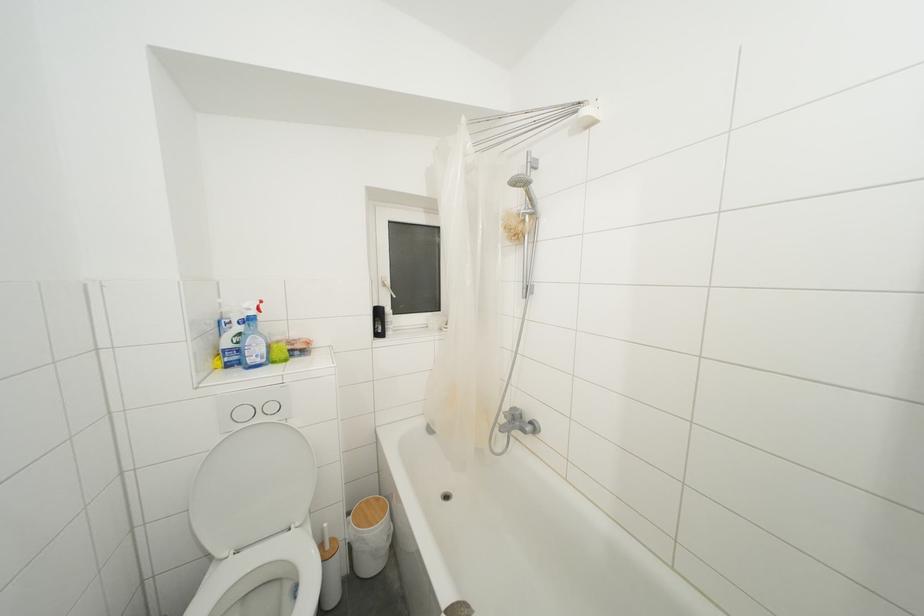
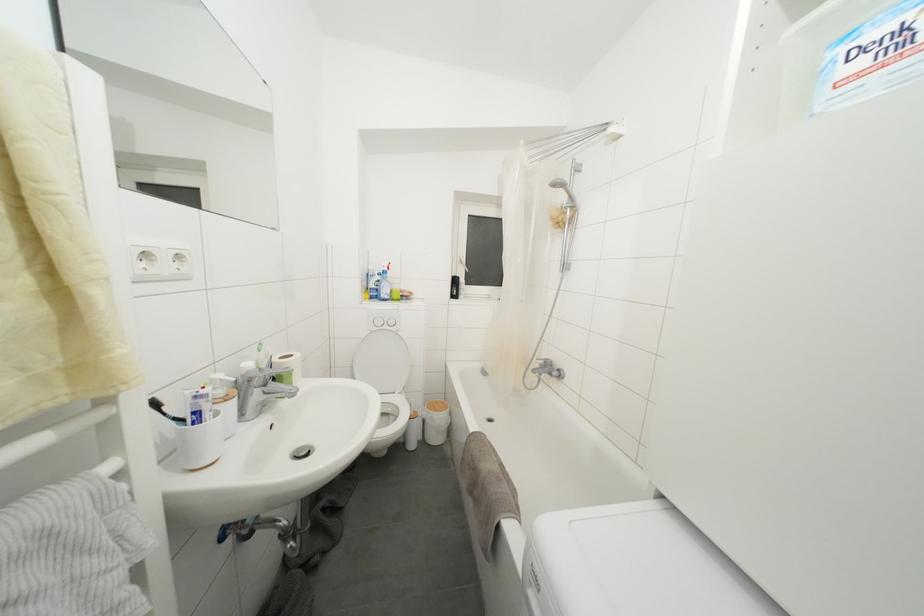
Question: The images are taken continuously from a first-person perspective. In which direction is your viewpoint rotating?

Choices:
 (A) Left
 (B) Right
 (C) Up
 (D) Down

Answer: (A)